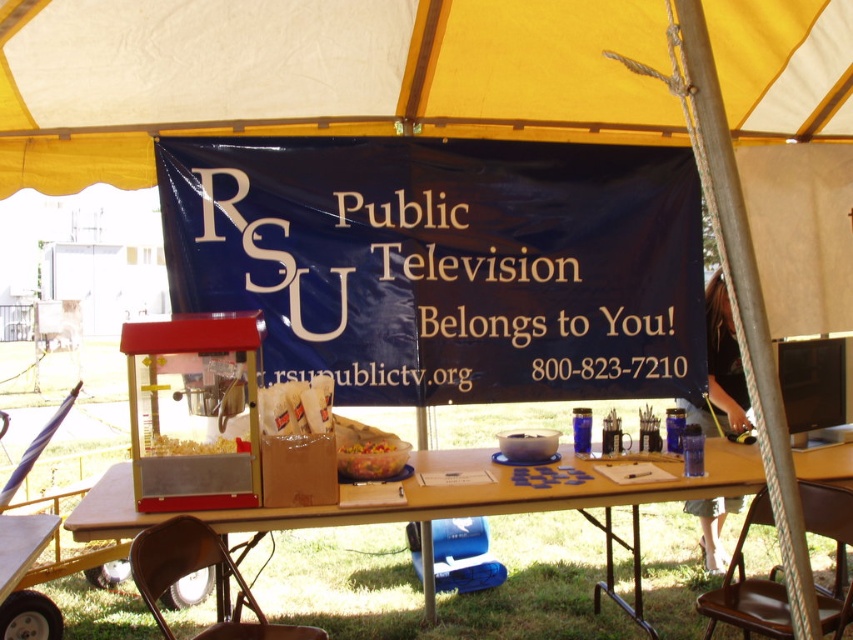
From the picture: You are organizing an event and need to place a metallic silver pen at right on the table next to the blue fabric banner at center. Since the banner is wider than the pen, will the pen fit horizontally next to the banner without overlapping?

The blue fabric banner at center is wider than the metallic silver pen at right, so placing the pen next to it horizontally should be possible as the pen is narrower. However, ensure there is enough space on the table for both items.

You are at an outdoor event and see the blue fabric banner at center and the metallic silver pen at right. Which object is positioned more to the left?

The blue fabric banner at center is positioned more to the left than the metallic silver pen at right.